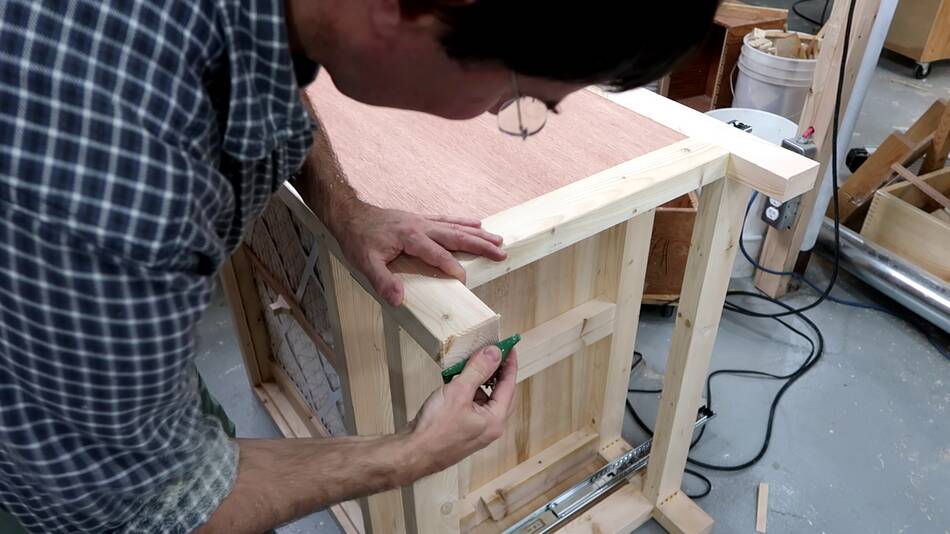
I want to click on cords, so click(829, 262), click(736, 463), click(636, 395).